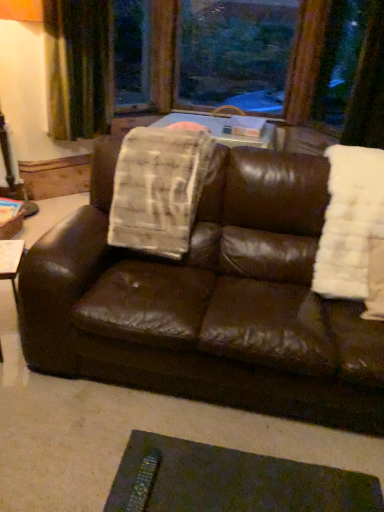
Where is `metallic textured remote at lower center`? Image resolution: width=384 pixels, height=512 pixels. metallic textured remote at lower center is located at coordinates (x=231, y=481).

What do you see at coordinates (131, 54) in the screenshot? I see `transparent glass window screen at upper center, arranged as the second window screen when viewed from the right` at bounding box center [131, 54].

What do you see at coordinates (209, 300) in the screenshot? The height and width of the screenshot is (512, 384). I see `brown leather couch at center` at bounding box center [209, 300].

The height and width of the screenshot is (512, 384). Describe the element at coordinates (158, 189) in the screenshot. I see `white textured blanket at center, the 2th blanket from the right` at that location.

Locate an element on the screen. white fluffy blanket at right, marked as the first blanket in a right-to-left arrangement is located at coordinates (352, 226).

Could you tell me if transparent glass window screen at upper center, arranged as the second window screen when viewed from the right, is turned towards transparent glass window at upper center, placed as the first window screen when sorted from right to left?

No, transparent glass window screen at upper center, arranged as the second window screen when viewed from the right, is not aimed at transparent glass window at upper center, placed as the first window screen when sorted from right to left.

Is transparent glass window screen at upper center, the 1th window screen in the left-to-right sequence, to the left of transparent glass window at upper center, placed as the first window screen when sorted from right to left, from the viewer's perspective?

Correct, you'll find transparent glass window screen at upper center, the 1th window screen in the left-to-right sequence, to the left of transparent glass window at upper center, placed as the first window screen when sorted from right to left.

From a real-world perspective, is transparent glass window screen at upper center, the 1th window screen in the left-to-right sequence, on transparent glass window at upper center, the second window screen viewed from the left?

No, from a real-world perspective, transparent glass window screen at upper center, the 1th window screen in the left-to-right sequence, is not above transparent glass window at upper center, the second window screen viewed from the left.

How much distance is there between transparent glass window screen at upper center, arranged as the second window screen when viewed from the right, and brown leather couch at center?

transparent glass window screen at upper center, arranged as the second window screen when viewed from the right, is 2.52 meters from brown leather couch at center.

Does transparent glass window screen at upper center, arranged as the second window screen when viewed from the right, have a larger size compared to brown leather couch at center?

Actually, transparent glass window screen at upper center, arranged as the second window screen when viewed from the right, might be smaller than brown leather couch at center.

Is the position of transparent glass window screen at upper center, the 1th window screen in the left-to-right sequence, more distant than that of brown leather couch at center?

Yes, transparent glass window screen at upper center, the 1th window screen in the left-to-right sequence, is behind brown leather couch at center.

Between transparent glass window screen at upper center, arranged as the second window screen when viewed from the right, and brown leather couch at center, which one has less height?

brown leather couch at center is shorter.

Is point (224, 51) closer or farther from the camera than point (54, 109)?

Point (224, 51).

From the image's perspective, does transparent glass window at upper center, placed as the first window screen when sorted from right to left, appear higher than green velvet curtain at upper left?

Correct, transparent glass window at upper center, placed as the first window screen when sorted from right to left, appears higher than green velvet curtain at upper left in the image.

Does transparent glass window at upper center, the second window screen viewed from the left, touch green velvet curtain at upper left?

No, transparent glass window at upper center, the second window screen viewed from the left, is not making contact with green velvet curtain at upper left.

From a real-world perspective, is transparent glass window at upper center, the second window screen viewed from the left, below white fluffy blanket at right, marked as the first blanket in a right-to-left arrangement?

Actually, transparent glass window at upper center, the second window screen viewed from the left, is physically above white fluffy blanket at right, marked as the first blanket in a right-to-left arrangement, in the real world.

Is point (239, 48) closer or farther from the camera than point (359, 169)?

Point (239, 48) is farther from the camera than point (359, 169).

Which of these two, transparent glass window at upper center, placed as the first window screen when sorted from right to left, or white fluffy blanket at right, the second blanket in the left-to-right sequence, is smaller?

Smaller between the two is white fluffy blanket at right, the second blanket in the left-to-right sequence.

Is transparent glass window at upper center, placed as the first window screen when sorted from right to left, far away from white fluffy blanket at right, marked as the first blanket in a right-to-left arrangement?

That's right, there is a large distance between transparent glass window at upper center, placed as the first window screen when sorted from right to left, and white fluffy blanket at right, marked as the first blanket in a right-to-left arrangement.

Do you think brown leather couch at center is within metallic textured remote at lower center, or outside of it?

brown leather couch at center lies outside metallic textured remote at lower center.

Does point (270, 399) come behind point (234, 474)?

That is True.

Where is `flat in front of the brown leather couch at center`? The height and width of the screenshot is (512, 384). flat in front of the brown leather couch at center is located at coordinates (231, 481).

Could you tell me if brown leather couch at center is turned towards metallic textured remote at lower center?

Yes, brown leather couch at center is turned towards metallic textured remote at lower center.

Identify the location of studio couch below the white textured blanket at center, the 1th blanket in the left-to-right sequence (from the image's perspective). (209, 300).

Looking at the image, does white textured blanket at center, the 2th blanket from the right, seem bigger or smaller compared to brown leather couch at center?

Considering their sizes, white textured blanket at center, the 2th blanket from the right, takes up less space than brown leather couch at center.

Does point (198, 150) appear closer or farther from the camera than point (277, 323)?

Point (198, 150) is farther from the camera than point (277, 323).

Could you tell me if white textured blanket at center, the 1th blanket in the left-to-right sequence, is facing brown leather couch at center?

Yes, white textured blanket at center, the 1th blanket in the left-to-right sequence, is facing brown leather couch at center.

This screenshot has height=512, width=384. I want to click on blanket that is the 2nd one when counting upward from the metallic textured remote at lower center (from the image's perspective), so click(x=158, y=189).

Can you confirm if metallic textured remote at lower center is thinner than white textured blanket at center, the 1th blanket in the left-to-right sequence?

Yes.

From a real-world perspective, is metallic textured remote at lower center located beneath white textured blanket at center, the 1th blanket in the left-to-right sequence?

Yes, from a real-world perspective, metallic textured remote at lower center is under white textured blanket at center, the 1th blanket in the left-to-right sequence.

The height and width of the screenshot is (512, 384). I want to click on window screen on the right of transparent glass window screen at upper center, arranged as the second window screen when viewed from the right, so click(x=235, y=53).

Locate an element on the screen. This screenshot has height=512, width=384. studio couch in front of the transparent glass window screen at upper center, the 1th window screen in the left-to-right sequence is located at coordinates (209, 300).

Based on their spatial positions, is green velvet curtain at upper left or brown leather couch at center further from white textured blanket at center, the 1th blanket in the left-to-right sequence?

green velvet curtain at upper left.

When comparing their distances from metallic textured remote at lower center, does brown leather couch at center or transparent glass window screen at upper center, the 1th window screen in the left-to-right sequence, seem further?

transparent glass window screen at upper center, the 1th window screen in the left-to-right sequence, is positioned further to the anchor metallic textured remote at lower center.

From the image, which object appears to be farther from transparent glass window at upper center, placed as the first window screen when sorted from right to left, white textured blanket at center, the 2th blanket from the right, or white fluffy blanket at right, the second blanket in the left-to-right sequence?

Based on the image, white fluffy blanket at right, the second blanket in the left-to-right sequence, appears to be further to transparent glass window at upper center, placed as the first window screen when sorted from right to left.

When comparing their distances from transparent glass window screen at upper center, the 1th window screen in the left-to-right sequence, does white fluffy blanket at right, the second blanket in the left-to-right sequence, or metallic textured remote at lower center seem closer?

white fluffy blanket at right, the second blanket in the left-to-right sequence, is positioned closer to the anchor transparent glass window screen at upper center, the 1th window screen in the left-to-right sequence.

In the scene shown: From the image, which object appears to be farther from brown leather couch at center, white fluffy blanket at right, the second blanket in the left-to-right sequence, or metallic textured remote at lower center?

metallic textured remote at lower center is further to brown leather couch at center.

Based on the photo, from the image, which object appears to be nearer to metallic textured remote at lower center, transparent glass window at upper center, placed as the first window screen when sorted from right to left, or white fluffy blanket at right, marked as the first blanket in a right-to-left arrangement?

The object closer to metallic textured remote at lower center is white fluffy blanket at right, marked as the first blanket in a right-to-left arrangement.

From the picture: When comparing their distances from transparent glass window at upper center, placed as the first window screen when sorted from right to left, does transparent glass window screen at upper center, the 1th window screen in the left-to-right sequence, or green velvet curtain at upper left seem closer?

The object closer to transparent glass window at upper center, placed as the first window screen when sorted from right to left, is transparent glass window screen at upper center, the 1th window screen in the left-to-right sequence.

From the image, which object appears to be nearer to transparent glass window at upper center, the second window screen viewed from the left, metallic textured remote at lower center or brown leather couch at center?

brown leather couch at center is closer to transparent glass window at upper center, the second window screen viewed from the left.

Identify the location of studio couch between white textured blanket at center, the 1th blanket in the left-to-right sequence, and white fluffy blanket at right, marked as the first blanket in a right-to-left arrangement, from left to right. (209, 300).

Find the location of a particular element. window screen between transparent glass window at upper center, placed as the first window screen when sorted from right to left, and metallic textured remote at lower center vertically is located at coordinates (131, 54).

At what (x,y) coordinates should I click in order to perform the action: click on blanket between white textured blanket at center, the 2th blanket from the right, and metallic textured remote at lower center from top to bottom. Please return your answer as a coordinate pair (x, y). Looking at the image, I should click on (352, 226).

This screenshot has width=384, height=512. In order to click on blanket located between white fluffy blanket at right, the second blanket in the left-to-right sequence, and transparent glass window at upper center, the second window screen viewed from the left, in the depth direction in this screenshot , I will do `click(158, 189)`.